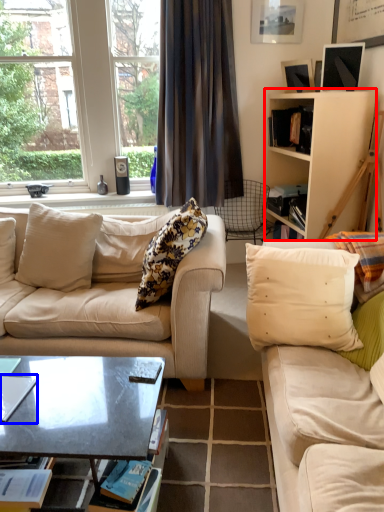
Question: Which object appears closest to the camera in this image, cabinetry (highlighted by a red box) or magazine (highlighted by a blue box)?

Choices:
 (A) cabinetry
 (B) magazine

Answer: (B)